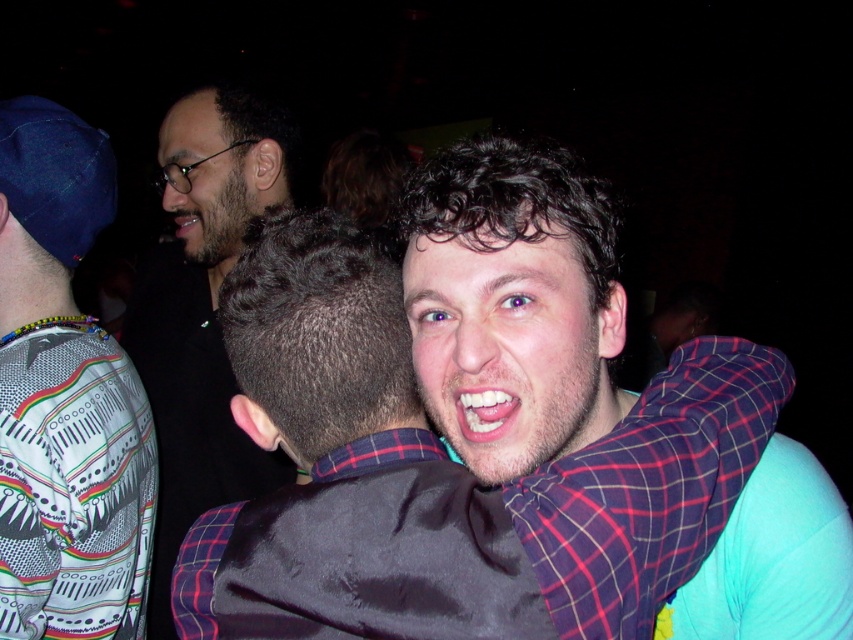
Question: Can you confirm if plaid shirt at center is positioned to the right of white dotted shirt at upper left?

Choices:
 (A) yes
 (B) no

Answer: (A)

Question: Can you confirm if white dotted shirt at upper left is positioned to the left of matte black shirt at upper left?

Choices:
 (A) yes
 (B) no

Answer: (A)

Question: Which is nearer to the white dotted shirt at upper left?

Choices:
 (A) plaid shirt at center
 (B) matte black shirt at upper left

Answer: (B)

Question: Can you confirm if plaid shirt at center is smaller than matte black shirt at upper left?

Choices:
 (A) yes
 (B) no

Answer: (A)

Question: Among these objects, which one is farthest from the camera?

Choices:
 (A) white dotted shirt at upper left
 (B) matte black shirt at upper left

Answer: (B)

Question: Which point is farther to the camera?

Choices:
 (A) white dotted shirt at upper left
 (B) plaid shirt at center

Answer: (A)